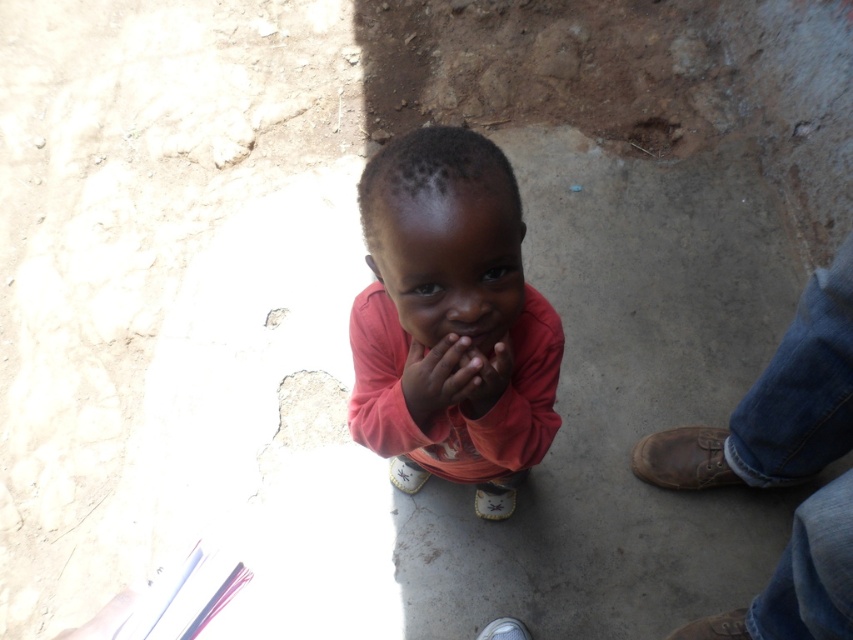
Question: Which of the following is the closest to the observer?

Choices:
 (A) (381, 380)
 (B) (474, 374)

Answer: (B)

Question: In this image, where is matte pink shirt at center located relative to smooth skin hand at center?

Choices:
 (A) below
 (B) above

Answer: (A)

Question: Which object is positioned farthest from the matte skin hand at center?

Choices:
 (A) smooth skin hand at center
 (B) matte pink shirt at center
 (C) white paper at center

Answer: (C)

Question: Based on their relative distances, which object is nearer to the white paper at center?

Choices:
 (A) matte skin hand at center
 (B) smooth skin hand at center
 (C) matte pink shirt at center

Answer: (C)

Question: Can you confirm if matte skin hand at center is positioned below white paper at center?

Choices:
 (A) no
 (B) yes

Answer: (B)

Question: Does matte pink shirt at center lie in front of white paper at center?

Choices:
 (A) no
 (B) yes

Answer: (B)